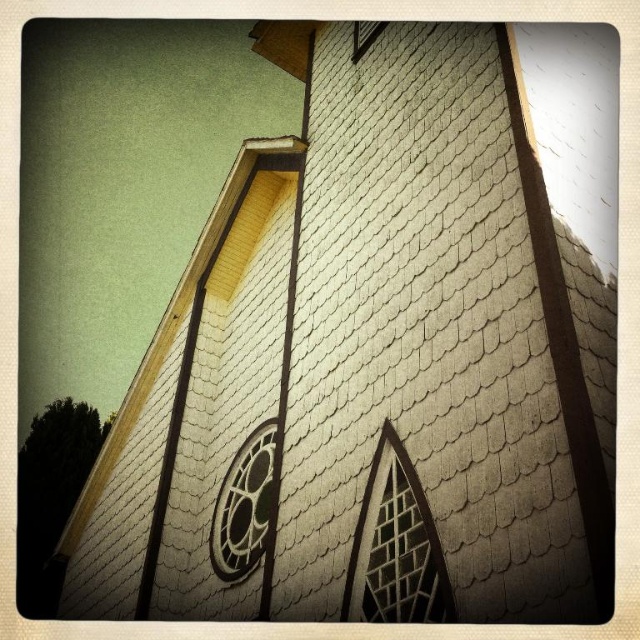
Question: Can you confirm if black glass window at center is bigger than clear glass window at upper center?

Choices:
 (A) yes
 (B) no

Answer: (A)

Question: Estimate the real-world distances between objects in this image. Which object is closer to the black glass window at center?

Choices:
 (A) translucent glass window at center
 (B) clear glass window at upper center

Answer: (A)

Question: Which object is positioned farthest from the black glass window at center?

Choices:
 (A) clear glass window at upper center
 (B) translucent glass window at center

Answer: (A)

Question: From the image, what is the correct spatial relationship of translucent glass window at center in relation to black glass window at center?

Choices:
 (A) above
 (B) below

Answer: (B)

Question: Is translucent glass window at center to the left of clear glass window at upper center from the viewer's perspective?

Choices:
 (A) yes
 (B) no

Answer: (A)

Question: Estimate the real-world distances between objects in this image. Which object is farther from the clear glass window at upper center?

Choices:
 (A) black glass window at center
 (B) translucent glass window at center

Answer: (B)